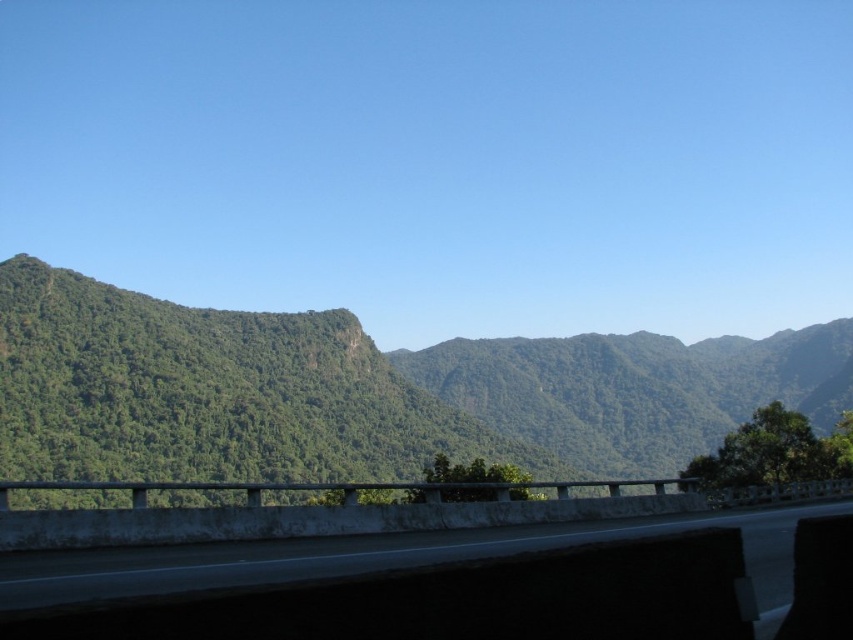
Which is below, green leafy mountain at left or concrete at center?

Positioned lower is green leafy mountain at left.

Measure the distance between point (643, 452) and camera.

A distance of 397.11 meters exists between point (643, 452) and camera.

The height and width of the screenshot is (640, 853). What are the coordinates of `green leafy mountain at left` in the screenshot? It's located at (363, 392).